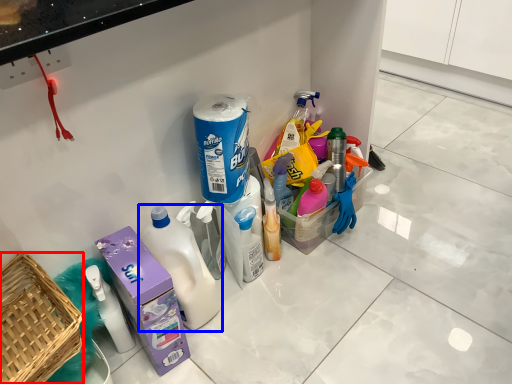
Question: Which object is closer to the camera taking this photo, basket (highlighted by a red box) or bottle (highlighted by a blue box)?

Choices:
 (A) basket
 (B) bottle

Answer: (A)